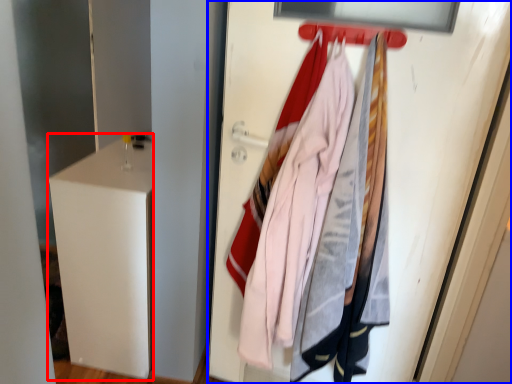
Question: Which point is closer to the camera, file cabinet (highlighted by a red box) or door (highlighted by a blue box)?

Choices:
 (A) file cabinet
 (B) door

Answer: (B)